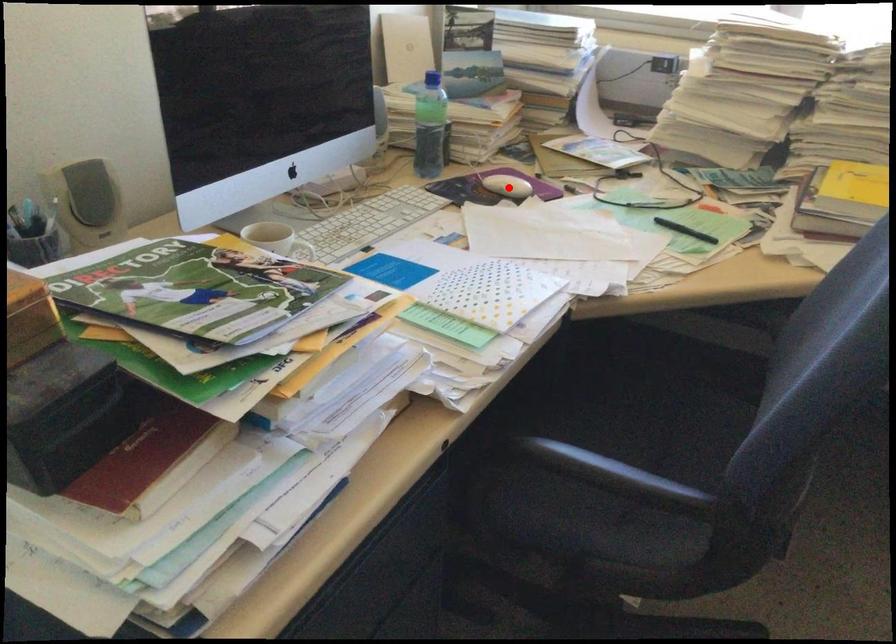
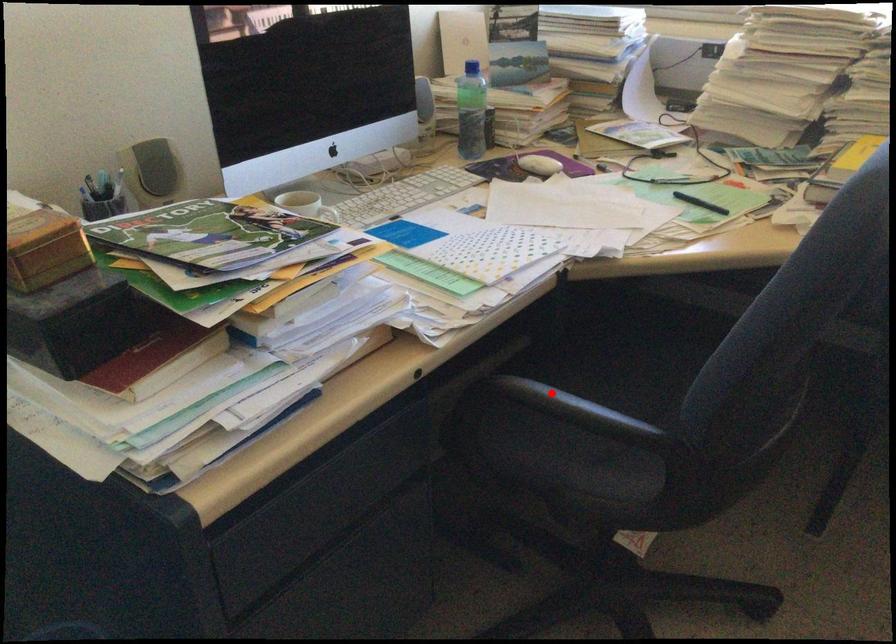
I am providing you with two images of the same scene from different viewpoints. A red point is marked on the first image and another point is marked on the second image. Do the highlighted points in image1 and image2 indicate the same real-world spot?

No